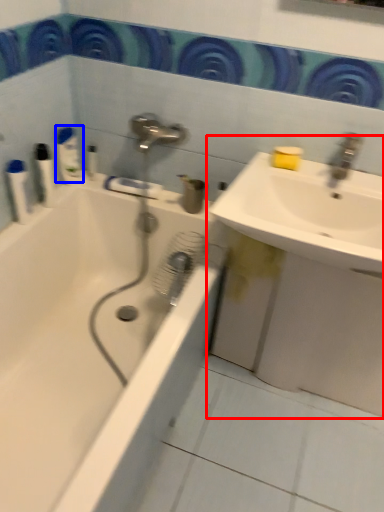
Question: Among these objects, which one is farthest to the camera, sink (highlighted by a red box) or toiletry (highlighted by a blue box)?

Choices:
 (A) sink
 (B) toiletry

Answer: (B)